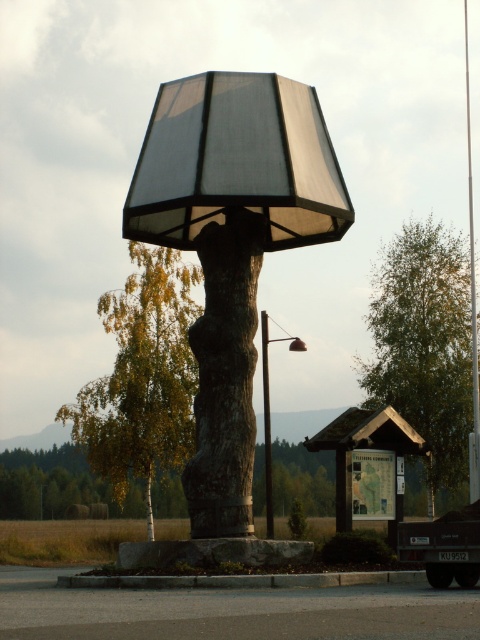
You are standing at the center of the installation and want to place a decorative stone exactly at the base of the matte black lampshade at center. According to the coordinates provided, where should you place the stone relative to the lampshade?

The matte black lampshade at center is located at point (231, 244), so you should place the decorative stone at the base directly below this coordinate.

You are a landscape architect designing a garden pathway that needs to pass between the green leafy tree at right and the metallic pole at center. The pathway must be at least 1 meter wide to accommodate wheelchairs. Based on the scene description, can the pathway between these two objects be wide enough?

The green leafy tree at right is thinner than the metallic pole at center, but the description does not provide specific measurements of their widths or the distance between them. Without knowing the exact dimensions of the objects or the space between them, it is impossible to determine if the pathway will be wide enough to meet the 1 meter requirement.

You are an artist planning to paint this scene. You want to ensure the proportions between the matte black lampshade at center and the green leafy tree at right are accurate. Based on the scene, which object is wider?

The green leafy tree at right is wider than the matte black lampshade at center.